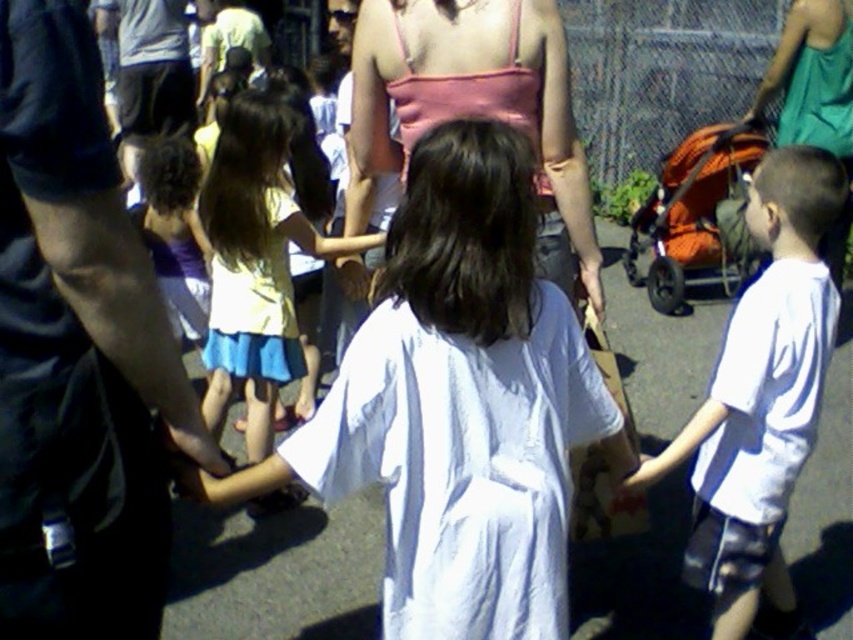
Question: Does pink fabric top at center appear on the right side of orange fabric stroller at right?

Choices:
 (A) yes
 (B) no

Answer: (B)

Question: Can you confirm if pink fabric top at center is positioned below yellow fabric dress at center?

Choices:
 (A) yes
 (B) no

Answer: (B)

Question: Which point appears closest to the camera in this image?

Choices:
 (A) (744, 195)
 (B) (598, 442)
 (C) (128, 298)

Answer: (C)

Question: Among these points, which one is nearest to the camera?

Choices:
 (A) (218, 403)
 (B) (281, 368)

Answer: (B)

Question: Where is orange fabric stroller at right located in relation to yellow fabric dress at center in the image?

Choices:
 (A) below
 (B) above

Answer: (B)

Question: Among these objects, which one is nearest to the camera?

Choices:
 (A) yellow fabric dress at center
 (B) pink fabric top at center
 (C) light yellow fabric dress at center
 (D) black fabric shirt at left

Answer: (D)